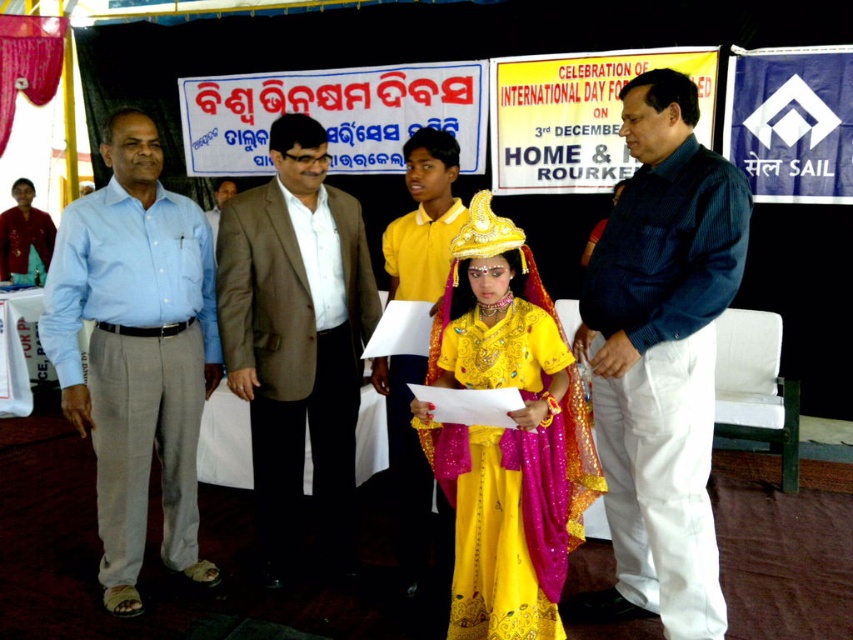
What do you see at coordinates (136, 352) in the screenshot? I see `light blue shirt at left` at bounding box center [136, 352].

Which is below, light blue shirt at left or light brown suit at center?

light blue shirt at left is lower down.

I want to click on light blue shirt at left, so click(136, 352).

Does shiny yellow fabric dress at center have a smaller size compared to matte black shirt at left?

Incorrect, shiny yellow fabric dress at center is not smaller in size than matte black shirt at left.

Can you confirm if shiny yellow fabric dress at center is positioned to the left of matte black shirt at left?

In fact, shiny yellow fabric dress at center is to the right of matte black shirt at left.

Does point (437, 477) come closer to viewer compared to point (28, 236)?

That is True.

The width and height of the screenshot is (853, 640). Identify the location of shiny yellow fabric dress at center. (508, 436).

Does matte brown suit at center appear under light brown suit at center?

Yes.

Does matte brown suit at center appear on the left side of light brown suit at center?

No, matte brown suit at center is not to the left of light brown suit at center.

Which is in front, point (442, 192) or point (213, 196)?

Point (442, 192) is in front.

Where is `matte brown suit at center`? This screenshot has height=640, width=853. matte brown suit at center is located at coordinates (424, 218).